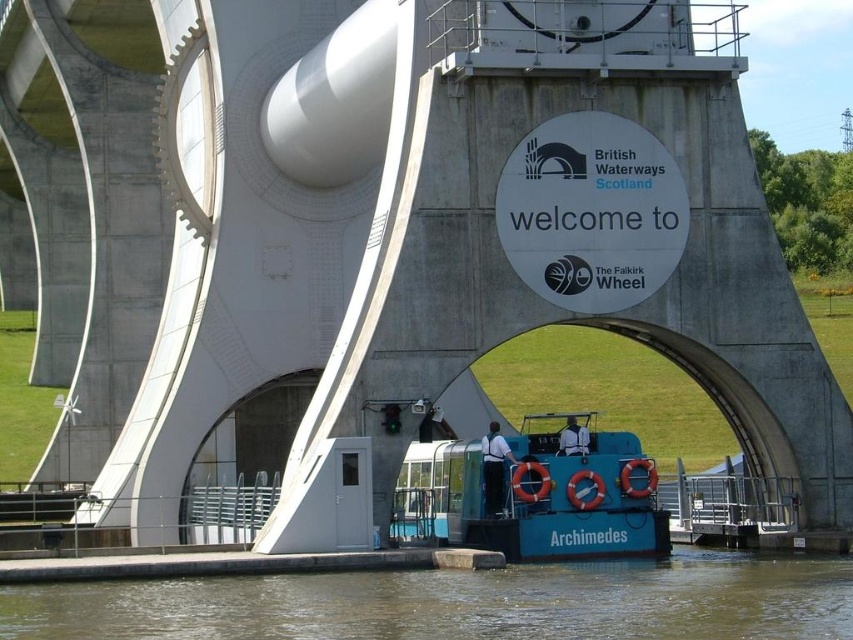
Question: Can you confirm if brown murky water at lower center is positioned below blue rubber boat at center?

Choices:
 (A) yes
 (B) no

Answer: (A)

Question: Does brown murky water at lower center appear under blue rubber boat at center?

Choices:
 (A) yes
 (B) no

Answer: (A)

Question: Is brown murky water at lower center wider than blue rubber boat at center?

Choices:
 (A) yes
 (B) no

Answer: (A)

Question: Which of the following is the closest to the observer?

Choices:
 (A) (421, 580)
 (B) (608, 458)

Answer: (A)

Question: Which point is closer to the camera?

Choices:
 (A) blue rubber boat at center
 (B) brown murky water at lower center

Answer: (B)